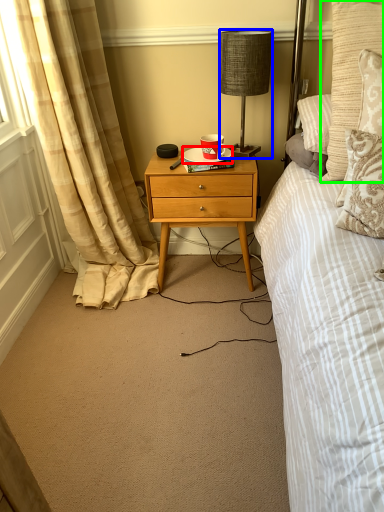
Question: Which object is the farthest from plate (highlighted by a red box)? Choose among these: lamp (highlighted by a blue box) or pillow (highlighted by a green box).

Choices:
 (A) lamp
 (B) pillow

Answer: (B)